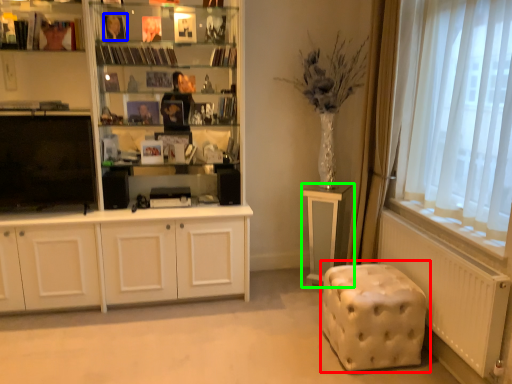
Question: Which is farther away from music stool (highlighted by a red box)? book (highlighted by a blue box) or table (highlighted by a green box)?

Choices:
 (A) book
 (B) table

Answer: (A)